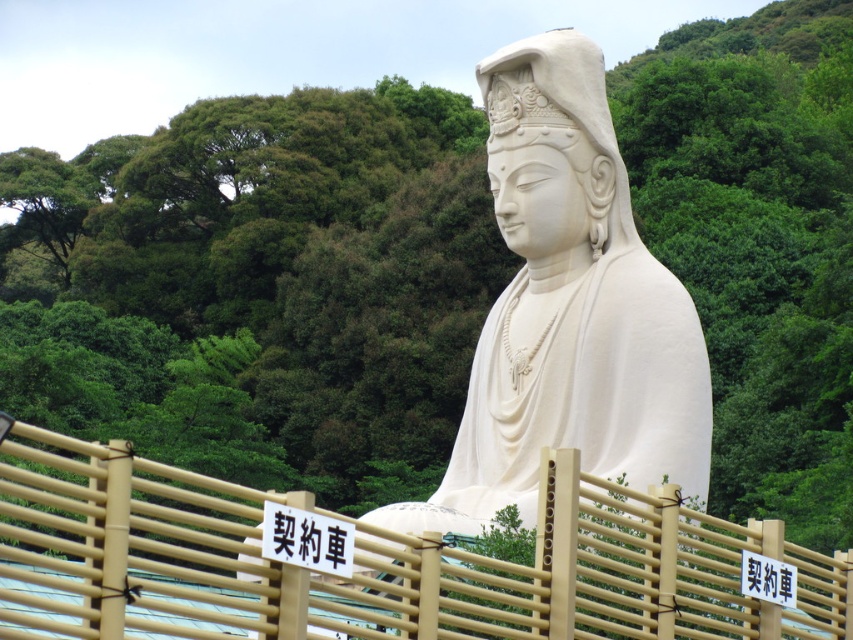
Question: Which object is closer to the camera taking this photo?

Choices:
 (A) bamboo fence at center
 (B) white marble statue at center
 (C) black paper sign at center

Answer: (A)

Question: Which point is closer to the camera?

Choices:
 (A) bamboo fence at center
 (B) black paper sign at center

Answer: (A)

Question: Is bamboo fence at center to the left of black paper sign at center from the viewer's perspective?

Choices:
 (A) no
 (B) yes

Answer: (B)

Question: Can you confirm if bamboo fence at center is wider than white marble statue at center?

Choices:
 (A) yes
 (B) no

Answer: (A)

Question: Is white marble statue at center closer to the viewer compared to black paper sign at center?

Choices:
 (A) no
 (B) yes

Answer: (A)

Question: Which of the following is the closest to the observer?

Choices:
 (A) (337, 563)
 (B) (590, 42)
 (C) (111, 477)

Answer: (C)